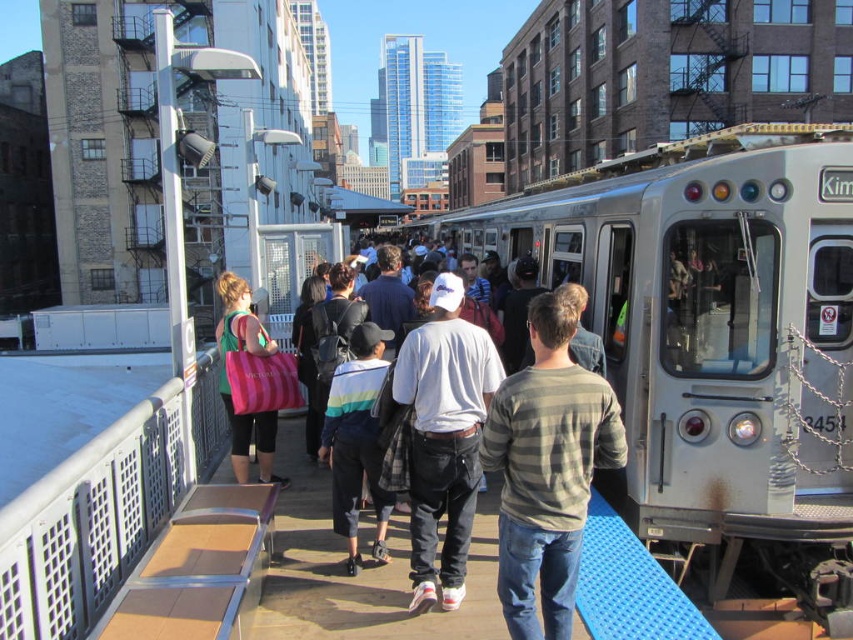
You are standing on the subway platform and want to find the white matte cap at center. According to the coordinates given, where should you look relative to the platform?

The white matte cap at center is located at coordinates point 0.684 on the x axis and 0.522 on the y axis relative to the platform.

You are observing a crowd at a subway station and notice two people wearing striped shirts. One is wearing a striped cotton shirt at center and the other a striped shirt at center. From your perspective, which striped shirt is located to the right?

The striped cotton shirt at center is positioned on the right side of striped shirt at center.

You are a photographer trying to capture a candid shot of the striped cotton shirt at center and the white matte cap at center in the subway station. Since you want to ensure both are clearly visible in the frame, which object should you focus on first to ensure depth of field?

You should focus on the striped cotton shirt at center first because it is smaller than the white matte cap at center, so ensuring sharpness on the smaller object will help maintain clarity for both in the depth of field.